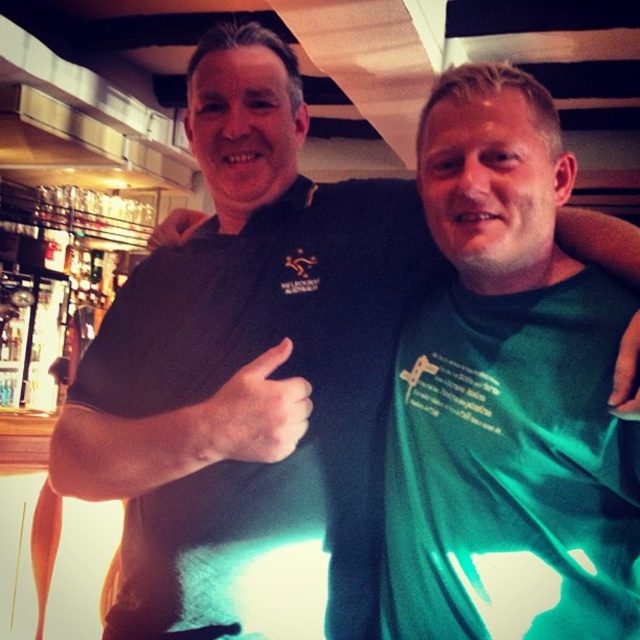
Does matte black thumb at center appear under green fabric hand at upper right?

Yes, matte black thumb at center is below green fabric hand at upper right.

Is matte black thumb at center positioned at the back of green fabric hand at upper right?

Yes.

This screenshot has width=640, height=640. What do you see at coordinates (252, 413) in the screenshot?
I see `matte black thumb at center` at bounding box center [252, 413].

Find the location of a particular element. The height and width of the screenshot is (640, 640). matte black thumb at center is located at coordinates (252, 413).

Which is more to the left, matte black thumb at center or matte black hand at upper center?

matte black hand at upper center is more to the left.

At what (x,y) coordinates should I click in order to perform the action: click on matte black thumb at center. Please return your answer as a coordinate pair (x, y). Image resolution: width=640 pixels, height=640 pixels. Looking at the image, I should click on (252, 413).

Where is `matte black thumb at center`? matte black thumb at center is located at coordinates (252, 413).

Is point (628, 413) positioned before point (180, 209)?

That is True.

Between green fabric hand at upper right and matte black hand at upper center, which one appears on the right side from the viewer's perspective?

green fabric hand at upper right is more to the right.

This screenshot has width=640, height=640. Find the location of `green fabric hand at upper right`. green fabric hand at upper right is located at coordinates (627, 372).

At what (x,y) coordinates should I click in order to perform the action: click on green fabric hand at upper right. Please return your answer as a coordinate pair (x, y). Looking at the image, I should click on pyautogui.click(x=627, y=372).